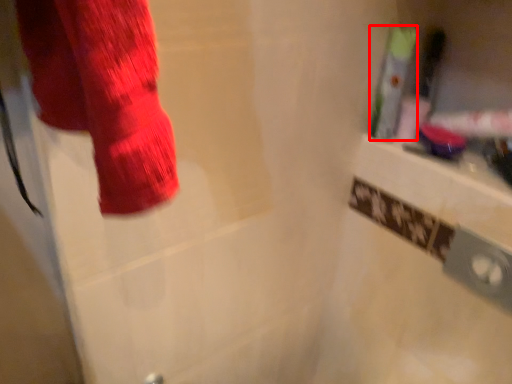
Question: From the image's perspective, where is toiletry (annotated by the red box) located in relation to toiletry in the image?

Choices:
 (A) below
 (B) above

Answer: (A)